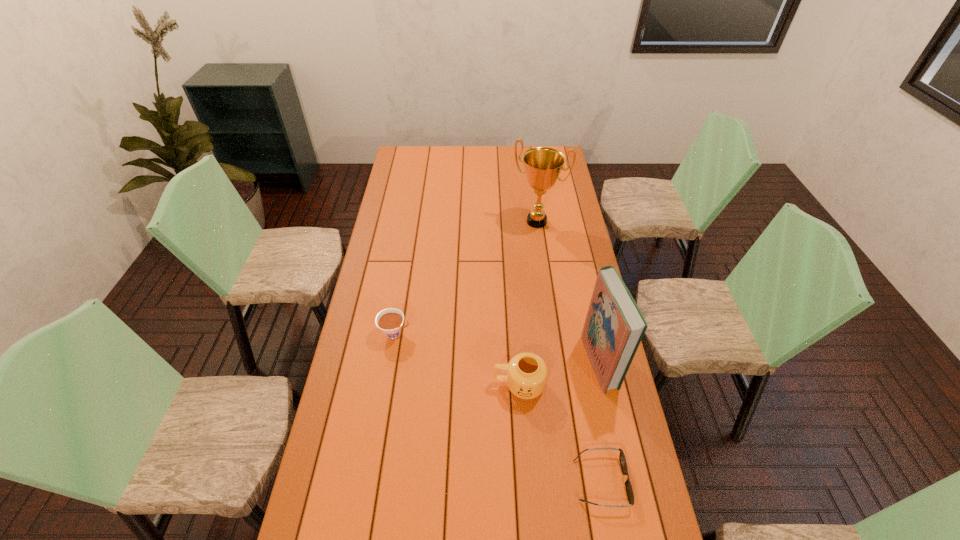
The image size is (960, 540). Find the location of `sunglasses that is at the right edge`. sunglasses that is at the right edge is located at coordinates (629, 490).

Find the location of `award that is at the right edge`. award that is at the right edge is located at coordinates (543, 165).

Where is `hardback book that is at the right edge`? hardback book that is at the right edge is located at coordinates (614, 327).

The width and height of the screenshot is (960, 540). In order to click on object that is at the near right corner in this screenshot , I will do `click(629, 490)`.

The height and width of the screenshot is (540, 960). What are the coordinates of `free space at the far edge of the desktop` in the screenshot? It's located at (468, 164).

Identify the location of free space at the near edge of the desktop. (515, 518).

What are the coordinates of `free space at the left edge of the desktop` in the screenshot? It's located at (377, 328).

Locate an element on the screen. vacant space at the right edge of the desktop is located at coordinates (587, 271).

In the image, there is a desktop. At what (x,y) coordinates should I click in order to perform the action: click on vacant space at the far left corner. Please return your answer as a coordinate pair (x, y). This screenshot has height=540, width=960. Looking at the image, I should click on (423, 160).

Identify the location of empty space that is in between the mug and the award. The image size is (960, 540). [x=528, y=303].